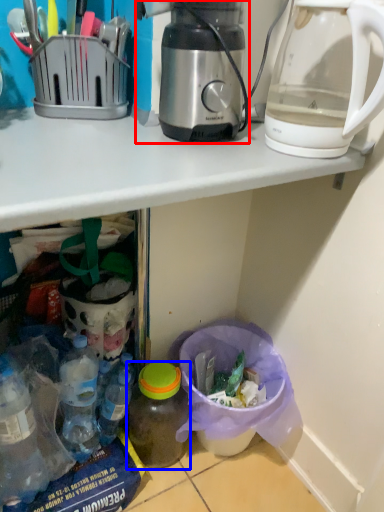
Question: Among these objects, which one is farthest to the camera, coffee maker (highlighted by a red box) or bottle (highlighted by a blue box)?

Choices:
 (A) coffee maker
 (B) bottle

Answer: (B)